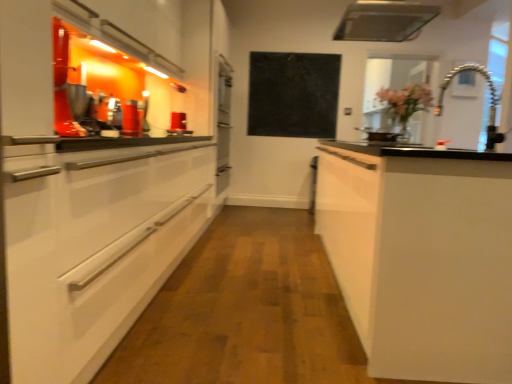
This screenshot has height=384, width=512. I want to click on transparent glass window at upper right, so click(392, 78).

Where is `white matte cabinet at right`? The width and height of the screenshot is (512, 384). white matte cabinet at right is located at coordinates (422, 257).

In order to face black matte board at center, should I rotate leftwards or rightwards?

To align with it, rotate right about 4.992°.

Image resolution: width=512 pixels, height=384 pixels. What do you see at coordinates (490, 102) in the screenshot? I see `flexible metallic faucet at upper right` at bounding box center [490, 102].

Image resolution: width=512 pixels, height=384 pixels. Find the location of `metallic silver exhaust hood at upper center`. metallic silver exhaust hood at upper center is located at coordinates (384, 21).

Considering the relative sizes of white matte cabinet at right and transparent glass window at upper right in the image provided, is white matte cabinet at right smaller than transparent glass window at upper right?

Actually, white matte cabinet at right might be larger than transparent glass window at upper right.

From the image's perspective, which object appears higher, white matte cabinet at right or transparent glass window at upper right?

transparent glass window at upper right appears higher in the image.

Is white matte cabinet at right next to transparent glass window at upper right and touching it?

white matte cabinet at right and transparent glass window at upper right are not in contact.

Is white matte cabinet at right wider than transparent glass window at upper right?

Indeed, white matte cabinet at right has a greater width compared to transparent glass window at upper right.

Which is in front, point (359, 273) or point (383, 38)?

Positioned in front is point (359, 273).

From the picture: From a real-world perspective, is white matte cabinet at right located higher than metallic silver exhaust hood at upper center?

Incorrect, from a real-world perspective, white matte cabinet at right is lower than metallic silver exhaust hood at upper center.

Could you tell me if transparent glass window at upper right is facing metallic silver exhaust hood at upper center?

No, transparent glass window at upper right is not aimed at metallic silver exhaust hood at upper center.

Locate an element on the screen. The height and width of the screenshot is (384, 512). window screen on the right side of metallic silver exhaust hood at upper center is located at coordinates (392, 78).

Is metallic silver exhaust hood at upper center located within transparent glass window at upper right?

No, metallic silver exhaust hood at upper center is not inside transparent glass window at upper right.

Considering the positions of objects transparent glass window at upper right and metallic silver exhaust hood at upper center in the image provided, who is behind, transparent glass window at upper right or metallic silver exhaust hood at upper center?

transparent glass window at upper right is behind.

How distant is flexible metallic faucet at upper right from black matte board at center?

flexible metallic faucet at upper right and black matte board at center are 1.75 meters apart.

Considering the relative sizes of flexible metallic faucet at upper right and black matte board at center in the image provided, is flexible metallic faucet at upper right wider than black matte board at center?

Indeed, flexible metallic faucet at upper right has a greater width compared to black matte board at center.

Which object is further away from the camera, flexible metallic faucet at upper right or black matte board at center?

black matte board at center is further away from the camera.

Can you confirm if flexible metallic faucet at upper right is positioned to the right of black matte board at center?

Yes.

This screenshot has width=512, height=384. Find the location of `exhaust hood above the black matte board at center (from the image's perspective)`. exhaust hood above the black matte board at center (from the image's perspective) is located at coordinates (384, 21).

How many degrees apart are the facing directions of black matte board at center and metallic silver exhaust hood at upper center?

90.8 degrees separate the facing orientations of black matte board at center and metallic silver exhaust hood at upper center.

Can you confirm if black matte board at center is positioned to the right of metallic silver exhaust hood at upper center?

No, black matte board at center is not to the right of metallic silver exhaust hood at upper center.

Is point (440, 93) closer or farther from the camera than point (368, 21)?

Point (440, 93) is positioned farther from the camera compared to point (368, 21).

Measure the distance between flexible metallic faucet at upper right and metallic silver exhaust hood at upper center.

flexible metallic faucet at upper right and metallic silver exhaust hood at upper center are 3.75 feet apart from each other.

Considering the relative positions of flexible metallic faucet at upper right and metallic silver exhaust hood at upper center in the image provided, is flexible metallic faucet at upper right to the left or to the right of metallic silver exhaust hood at upper center?

Based on their positions, flexible metallic faucet at upper right is located to the left of metallic silver exhaust hood at upper center.

Is flexible metallic faucet at upper right outside of metallic silver exhaust hood at upper center?

flexible metallic faucet at upper right lies outside metallic silver exhaust hood at upper center's area.

You are a GUI agent. You are given a task and a screenshot of the screen. Output one action in this format:
    pyautogui.click(x=<x>, y=<y>)
    Task: Click on the window screen that is above the flexible metallic faucet at upper right (from a real-world perspective)
    The height and width of the screenshot is (384, 512).
    Given the screenshot: What is the action you would take?
    pyautogui.click(x=392, y=78)

From the picture: How different are the orientations of transparent glass window at upper right and flexible metallic faucet at upper right in degrees?

The facing directions of transparent glass window at upper right and flexible metallic faucet at upper right are 0.924 degrees apart.

Is transparent glass window at upper right placed right next to flexible metallic faucet at upper right?

They are not placed beside each other.

From a real-world perspective, is transparent glass window at upper right below flexible metallic faucet at upper right?

Actually, transparent glass window at upper right is physically above flexible metallic faucet at upper right in the real world.

This screenshot has width=512, height=384. In order to click on cabinetry on the left side of transparent glass window at upper right in this screenshot , I will do `click(422, 257)`.

Where is `exhaust hood to the right of white matte cabinet at right`? exhaust hood to the right of white matte cabinet at right is located at coordinates (384, 21).

When comparing their distances from transparent glass window at upper right, does metallic silver exhaust hood at upper center or flexible metallic faucet at upper right seem closer?

flexible metallic faucet at upper right lies closer to transparent glass window at upper right than the other object.

Based on their spatial positions, is metallic silver exhaust hood at upper center or transparent glass window at upper right further from white matte cabinet at right?

transparent glass window at upper right is positioned further to the anchor white matte cabinet at right.

From the image, which object appears to be farther from flexible metallic faucet at upper right, white matte cabinet at right or metallic silver exhaust hood at upper center?

Based on the image, white matte cabinet at right appears to be further to flexible metallic faucet at upper right.

Based on their spatial positions, is white matte cabinet at right or flexible metallic faucet at upper right closer to transparent glass window at upper right?

flexible metallic faucet at upper right lies closer to transparent glass window at upper right than the other object.

Based on their spatial positions, is white matte cabinet at right or transparent glass window at upper right closer to metallic silver exhaust hood at upper center?

Among the two, transparent glass window at upper right is located nearer to metallic silver exhaust hood at upper center.

Looking at this image, from the image, which object appears to be farther from metallic silver exhaust hood at upper center, transparent glass window at upper right or black matte board at center?

Based on the image, black matte board at center appears to be further to metallic silver exhaust hood at upper center.

Considering their positions, is black matte board at center positioned closer to flexible metallic faucet at upper right than transparent glass window at upper right?

The object closer to flexible metallic faucet at upper right is transparent glass window at upper right.

Based on their spatial positions, is black matte board at center or white matte cabinet at right closer to flexible metallic faucet at upper right?

black matte board at center.

Find the location of `exhaust hood located between white matte cabinet at right and black matte board at center in the depth direction`. exhaust hood located between white matte cabinet at right and black matte board at center in the depth direction is located at coordinates (384, 21).

This screenshot has height=384, width=512. I want to click on bulletin board between metallic silver exhaust hood at upper center and transparent glass window at upper right along the z-axis, so click(293, 94).

You are a GUI agent. You are given a task and a screenshot of the screen. Output one action in this format:
    pyautogui.click(x=<x>, y=<y>)
    Task: Click on the exhaust hood between white matte cabinet at right and transparent glass window at upper right in the front-back direction
    The image size is (512, 384).
    Given the screenshot: What is the action you would take?
    pyautogui.click(x=384, y=21)

Where is `faucet between white matte cabinet at right and transparent glass window at upper right in the front-back direction`? faucet between white matte cabinet at right and transparent glass window at upper right in the front-back direction is located at coordinates (490, 102).